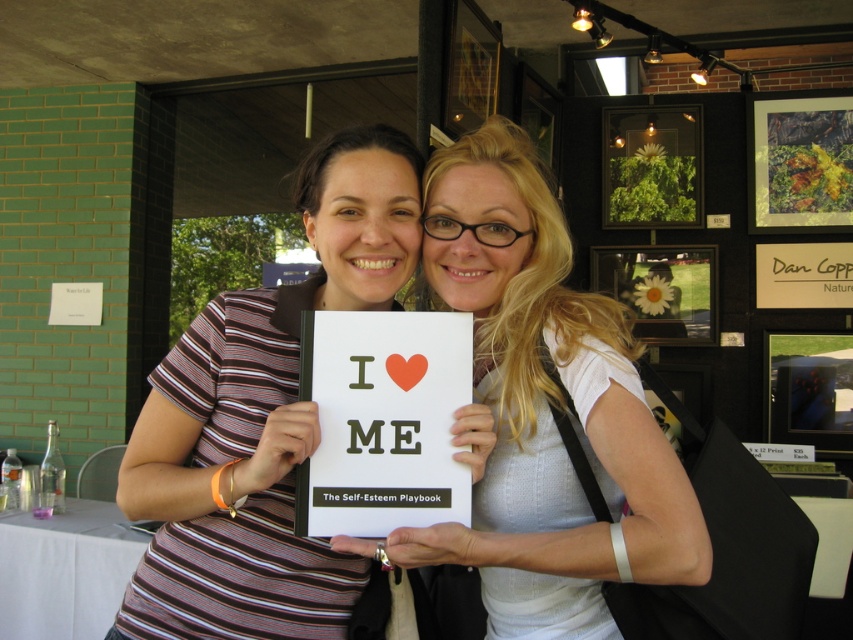
Question: Which object is closer to the camera taking this photo?

Choices:
 (A) white matte book at center
 (B) white paper book at center
 (C) white paper at center

Answer: (A)

Question: In this image, where is white matte book at center located relative to white paper at center?

Choices:
 (A) above
 (B) below

Answer: (A)

Question: Estimate the real-world distances between objects in this image. Which object is farther from the white matte book at center?

Choices:
 (A) white paper book at center
 (B) white paper at center

Answer: (A)

Question: Considering the relative positions of white paper book at center and white paper at center in the image provided, where is white paper book at center located with respect to white paper at center?

Choices:
 (A) right
 (B) left

Answer: (B)

Question: Estimate the real-world distances between objects in this image. Which object is closer to the white matte book at center?

Choices:
 (A) white paper at center
 (B) white paper book at center

Answer: (A)

Question: Can you confirm if white paper book at center is bigger than white paper at center?

Choices:
 (A) yes
 (B) no

Answer: (A)